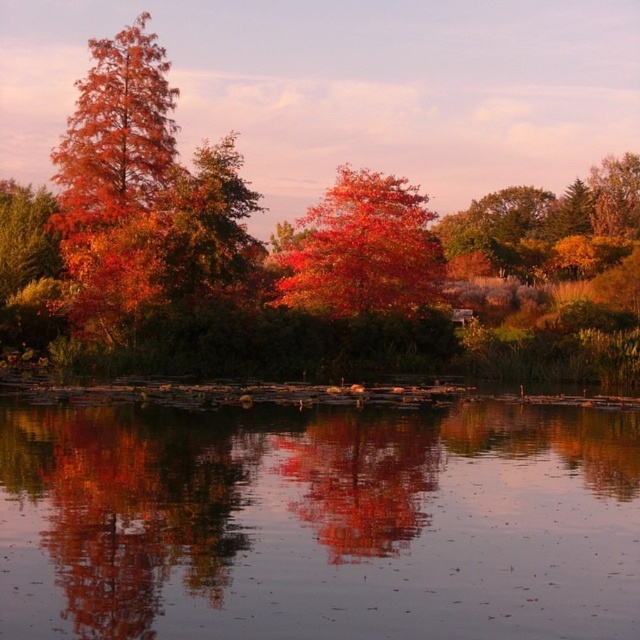
You are an artist trying to paint the scene. You need to decide which object to paint first based on their sizes. Which one should you start with, the smooth reflective water at center or the shiny orange tree at left?

The shiny orange tree at left is larger than the smooth reflective water at center, so you should start with the shiny orange tree at left to ensure proper scaling in your painting.

You are standing at the edge of the water and want to take a photo of the smooth reflective water at center. Which direction should you face to capture its reflection?

The smooth reflective water at center is located at point (317, 522), so you should face towards the center of the image to capture its reflection.

You are an artist trying to paint the autumn scene. You notice two types of leaves at the center of the image. Which of the two, the shiny metallic leaves at center or the shiny red leaves at center, would you need to paint with more detail because they are smaller?

The shiny metallic leaves at center is smaller than shiny red leaves at center, so you would need to paint the shiny metallic leaves at center with more detail because they are smaller.